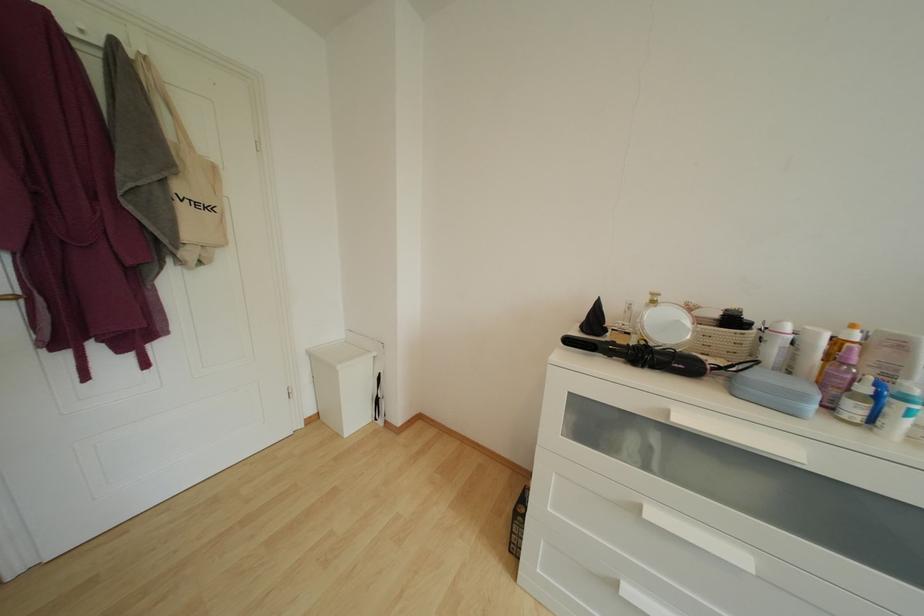
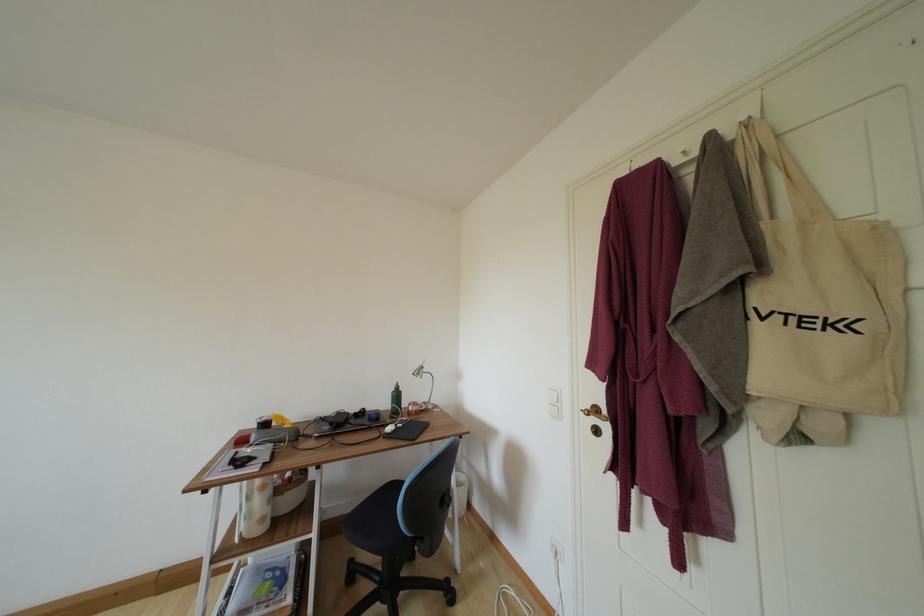
Find the pixel in the second image that matches point (150, 62) in the first image.

(751, 128)